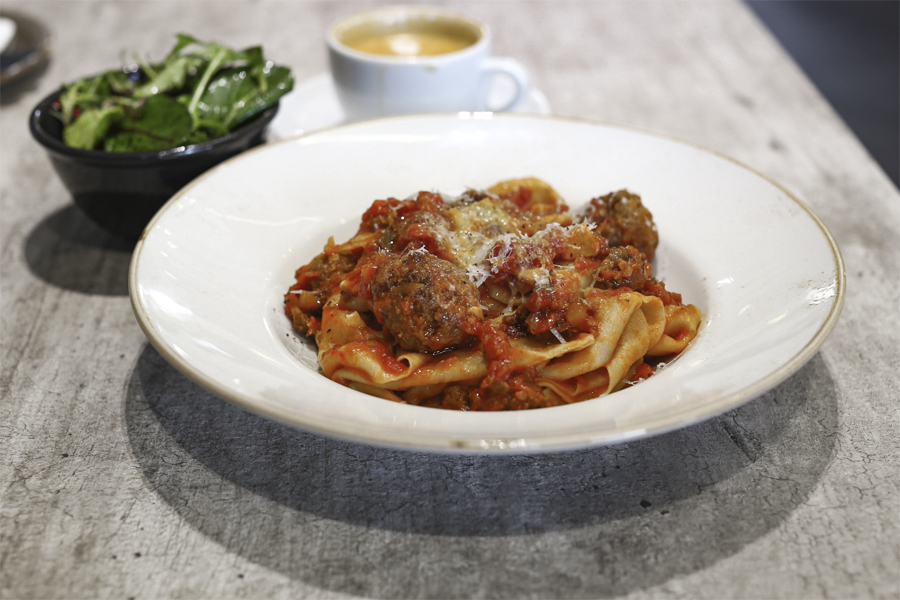
Locate an element on the screen. This screenshot has width=900, height=600. table is located at coordinates (747, 63).